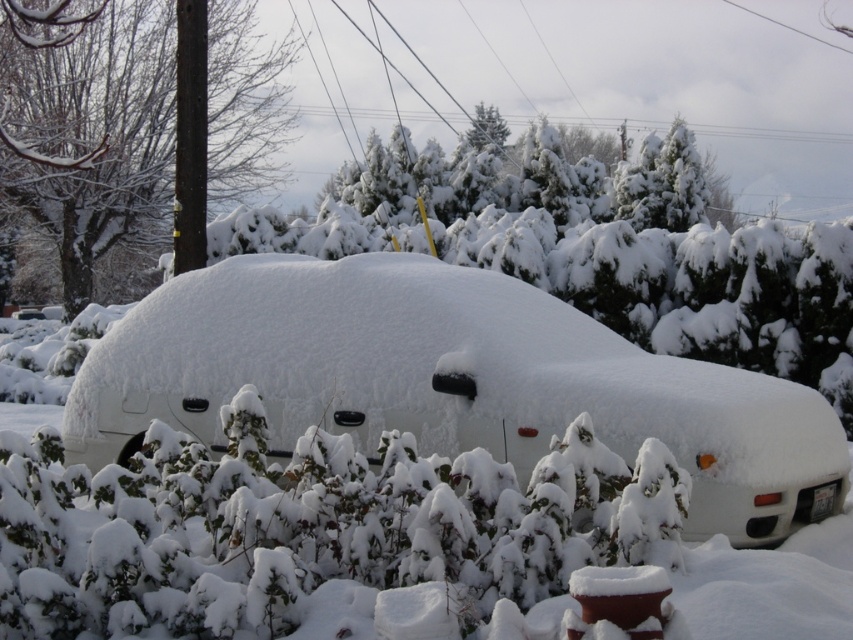
Is point (80, 406) closer to camera compared to point (142, 42)?

Yes, point (80, 406) is in front of point (142, 42).

Can you confirm if white matte car at center is shorter than snow-covered shrub at left?

No.

At what (x,y) coordinates should I click in order to perform the action: click on white matte car at center. Please return your answer as a coordinate pair (x, y). The width and height of the screenshot is (853, 640). Looking at the image, I should click on (450, 380).

You are a GUI agent. You are given a task and a screenshot of the screen. Output one action in this format:
    pyautogui.click(x=<x>, y=<y>)
    Task: Click on the white matte car at center
    This screenshot has width=853, height=640.
    Given the screenshot: What is the action you would take?
    pyautogui.click(x=450, y=380)

Can you confirm if white fluffy bush at lower center is taller than snow-covered shrub at left?

Indeed, white fluffy bush at lower center has a greater height compared to snow-covered shrub at left.

Can you confirm if white fluffy bush at lower center is shorter than snow-covered shrub at left?

No.

What do you see at coordinates (310, 529) in the screenshot?
I see `white fluffy bush at lower center` at bounding box center [310, 529].

Identify the location of white fluffy bush at lower center. (310, 529).

I want to click on white matte car at center, so click(x=450, y=380).

Who is more distant from viewer, (335, 388) or (152, 540)?

Point (335, 388)

The height and width of the screenshot is (640, 853). In order to click on white matte car at center in this screenshot , I will do `click(450, 380)`.